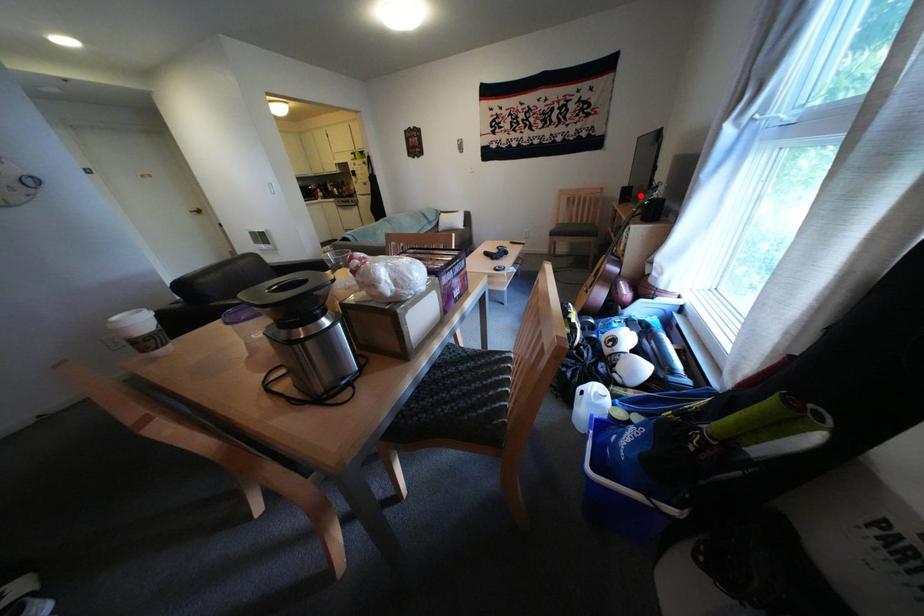
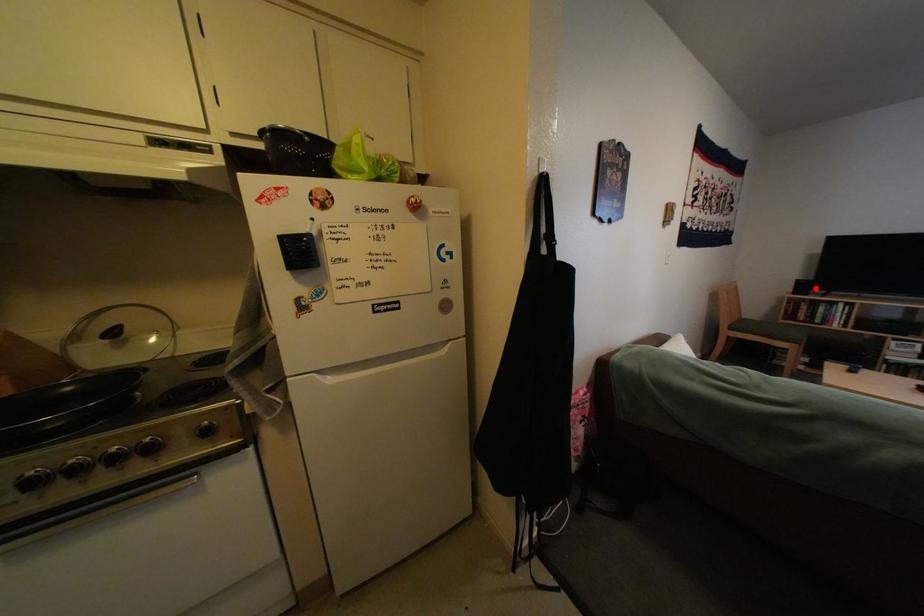
I am providing you with two images of the same scene from different viewpoints. A red point is marked on the first image and another point is marked on the second image. Is the red point in image1 aligned with the point shown in image2?

Yes